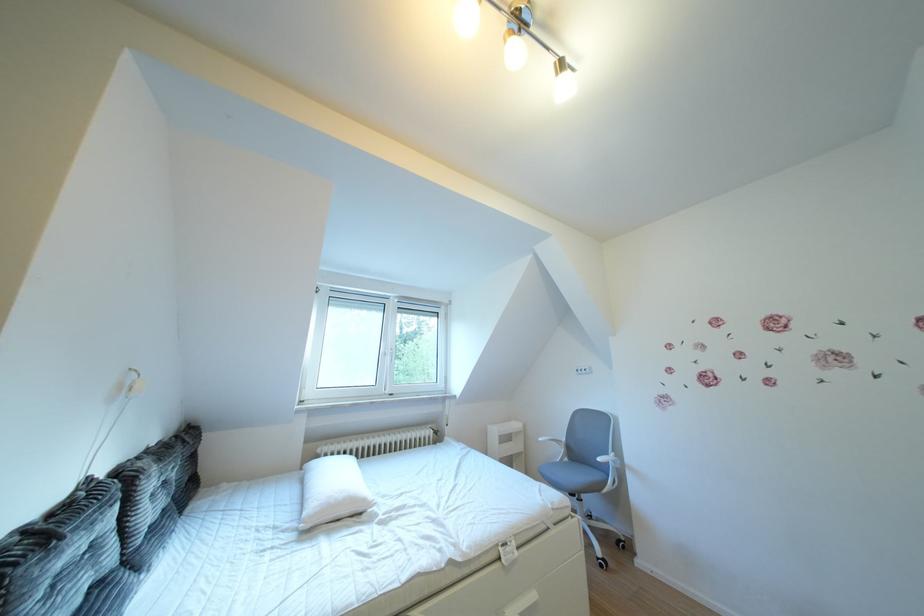
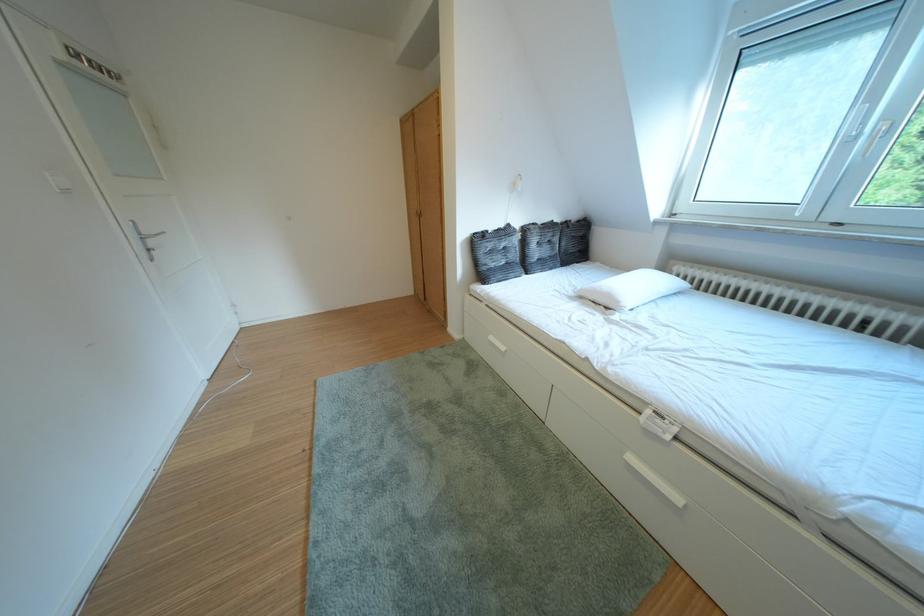
The point at (103, 485) is marked in the first image. Where is the corresponding point in the second image?

(523, 230)